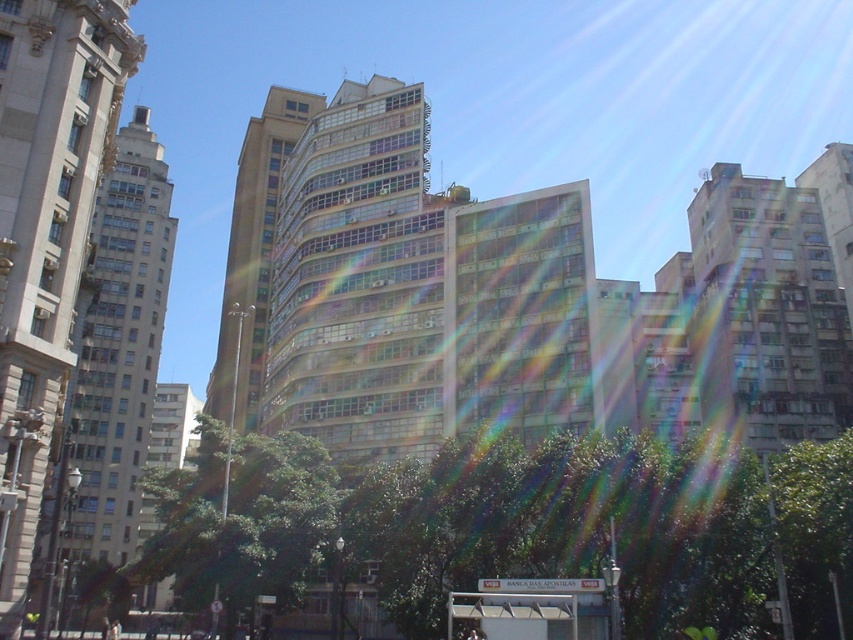
Is green leafy tree at lower center closer to camera compared to green leafy tree at center?

That is True.

Is green leafy tree at lower center positioned behind green leafy tree at center?

No.

Locate an element on the screen. Image resolution: width=853 pixels, height=640 pixels. green leafy tree at lower center is located at coordinates (479, 525).

Does green leafy tree at center appear on the left side of white plastic bus stop at lower center?

Indeed, green leafy tree at center is positioned on the left side of white plastic bus stop at lower center.

Who is lower down, green leafy tree at center or white plastic bus stop at lower center?

white plastic bus stop at lower center is lower down.

Does point (213, 515) lie in front of point (595, 596)?

That is False.

Locate an element on the screen. The height and width of the screenshot is (640, 853). green leafy tree at center is located at coordinates (242, 520).

Is smooth beige building at left positioned in front of green leafy tree at center?

That is True.

Which of these two, smooth beige building at left or green leafy tree at center, stands shorter?

green leafy tree at center is shorter.

This screenshot has height=640, width=853. What do you see at coordinates (45, 236) in the screenshot? I see `smooth beige building at left` at bounding box center [45, 236].

Locate an element on the screen. smooth beige building at left is located at coordinates (45, 236).